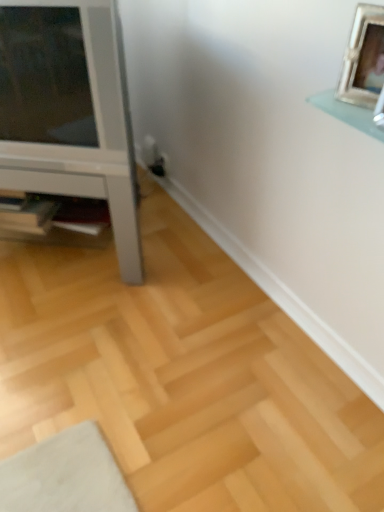
This screenshot has height=512, width=384. What do you see at coordinates (69, 111) in the screenshot? I see `white glossy tv stand at left` at bounding box center [69, 111].

The height and width of the screenshot is (512, 384). Describe the element at coordinates (363, 58) in the screenshot. I see `silver metallic picture frame at upper right` at that location.

Where is `wooden shelf at lower left`? wooden shelf at lower left is located at coordinates (57, 221).

Based on the photo, from the image's perspective, which one is positioned higher, wooden shelf at lower left or silver metallic picture frame at upper right?

silver metallic picture frame at upper right.

The height and width of the screenshot is (512, 384). I want to click on shelf behind the silver metallic picture frame at upper right, so click(x=57, y=221).

Is wooden shelf at lower left turned away from silver metallic picture frame at upper right?

No, silver metallic picture frame at upper right is not at the back of wooden shelf at lower left.

From the image's perspective, is white glossy tv stand at left located above or below silver metallic picture frame at upper right?

From the image's perspective, white glossy tv stand at left appears below silver metallic picture frame at upper right.

Looking at this image, considering the relative sizes of white glossy tv stand at left and silver metallic picture frame at upper right in the image provided, is white glossy tv stand at left wider than silver metallic picture frame at upper right?

Answer: Indeed, white glossy tv stand at left has a greater width compared to silver metallic picture frame at upper right.

Considering their positions, is white glossy tv stand at left located in front of or behind silver metallic picture frame at upper right?

Clearly, white glossy tv stand at left is behind silver metallic picture frame at upper right.

Considering the relative sizes of wooden shelf at lower left and white glossy tv stand at left in the image provided, is wooden shelf at lower left smaller than white glossy tv stand at left?

Yes.

What's the angular difference between wooden shelf at lower left and white glossy tv stand at left's facing directions?

The angle between the facing direction of wooden shelf at lower left and the facing direction of white glossy tv stand at left is 5.8 degrees.

Is wooden shelf at lower left facing towards white glossy tv stand at left?

Yes, wooden shelf at lower left is oriented towards white glossy tv stand at left.

Considering the positions of point (78, 206) and point (98, 170), is point (78, 206) closer or farther from the camera than point (98, 170)?

Point (78, 206) is positioned farther from the camera compared to point (98, 170).

Could you tell me if white glossy tv stand at left is turned towards wooden shelf at lower left?

Yes, white glossy tv stand at left is facing wooden shelf at lower left.

The height and width of the screenshot is (512, 384). In the image, there is a wooden shelf at lower left. In order to click on furniture above it (from the image's perspective) in this screenshot , I will do `click(69, 111)`.

Considering the sizes of objects white glossy tv stand at left and wooden shelf at lower left in the image provided, who is smaller, white glossy tv stand at left or wooden shelf at lower left?

wooden shelf at lower left.

Is white glossy tv stand at left far away from wooden shelf at lower left?

Actually, white glossy tv stand at left and wooden shelf at lower left are a little close together.

Would you say silver metallic picture frame at upper right is to the left or to the right of white glossy tv stand at left in the picture?

Clearly, silver metallic picture frame at upper right is on the right of white glossy tv stand at left in the image.

Is silver metallic picture frame at upper right positioned behind white glossy tv stand at left?

That is False.

Which point is more distant from viewer, (360, 96) or (92, 108)?

The point (92, 108) is more distant.

From the image's perspective, which object appears higher, silver metallic picture frame at upper right or white glossy tv stand at left?

silver metallic picture frame at upper right appears higher in the image.

In terms of height, does silver metallic picture frame at upper right look taller or shorter compared to wooden shelf at lower left?

Clearly, silver metallic picture frame at upper right is taller compared to wooden shelf at lower left.

Would you say silver metallic picture frame at upper right is outside wooden shelf at lower left?

Absolutely, silver metallic picture frame at upper right is external to wooden shelf at lower left.

In the image, is silver metallic picture frame at upper right positioned in front of or behind wooden shelf at lower left?

Visually, silver metallic picture frame at upper right is located in front of wooden shelf at lower left.

Is the surface of silver metallic picture frame at upper right in direct contact with wooden shelf at lower left?

No, silver metallic picture frame at upper right is not in contact with wooden shelf at lower left.

The width and height of the screenshot is (384, 512). In order to click on picture frame that appears above the wooden shelf at lower left (from the image's perspective) in this screenshot , I will do `click(363, 58)`.

The image size is (384, 512). I want to click on furniture on the left of silver metallic picture frame at upper right, so click(69, 111).

Based on their spatial positions, is wooden shelf at lower left or white glossy tv stand at left closer to silver metallic picture frame at upper right?

The object closer to silver metallic picture frame at upper right is white glossy tv stand at left.

Estimate the real-world distances between objects in this image. Which object is further from white glossy tv stand at left, silver metallic picture frame at upper right or wooden shelf at lower left?

The object further to white glossy tv stand at left is silver metallic picture frame at upper right.

Considering their positions, is white glossy tv stand at left positioned closer to silver metallic picture frame at upper right than wooden shelf at lower left?

Among the two, white glossy tv stand at left is located nearer to silver metallic picture frame at upper right.

Considering their positions, is silver metallic picture frame at upper right positioned closer to wooden shelf at lower left than white glossy tv stand at left?

Among the two, white glossy tv stand at left is located nearer to wooden shelf at lower left.

When comparing their distances from wooden shelf at lower left, does white glossy tv stand at left or silver metallic picture frame at upper right seem further?

Among the two, silver metallic picture frame at upper right is located further to wooden shelf at lower left.

Which object lies further to the anchor point white glossy tv stand at left, wooden shelf at lower left or silver metallic picture frame at upper right?

Among the two, silver metallic picture frame at upper right is located further to white glossy tv stand at left.

This screenshot has width=384, height=512. What are the coordinates of `shelf between white glossy tv stand at left and silver metallic picture frame at upper right from left to right` in the screenshot? It's located at (57, 221).